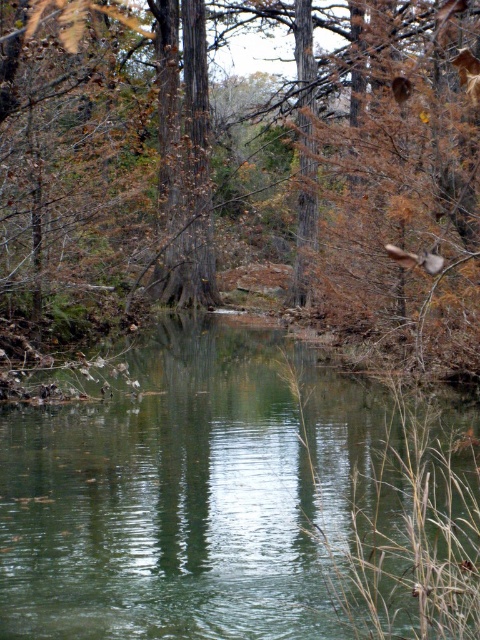
Question: Among these points, which one is nearest to the camera?

Choices:
 (A) (325, 464)
 (B) (407, 227)

Answer: (A)

Question: Observing the image, what is the correct spatial positioning of green smooth water at center in reference to brown wood tree at center?

Choices:
 (A) left
 (B) right

Answer: (B)

Question: Which object appears farthest from the camera in this image?

Choices:
 (A) brown wood tree at center
 (B) green smooth water at center

Answer: (A)

Question: Does green smooth water at center appear under brown wood tree at center?

Choices:
 (A) no
 (B) yes

Answer: (B)

Question: Does green smooth water at center come in front of brown wood tree at center?

Choices:
 (A) no
 (B) yes

Answer: (B)